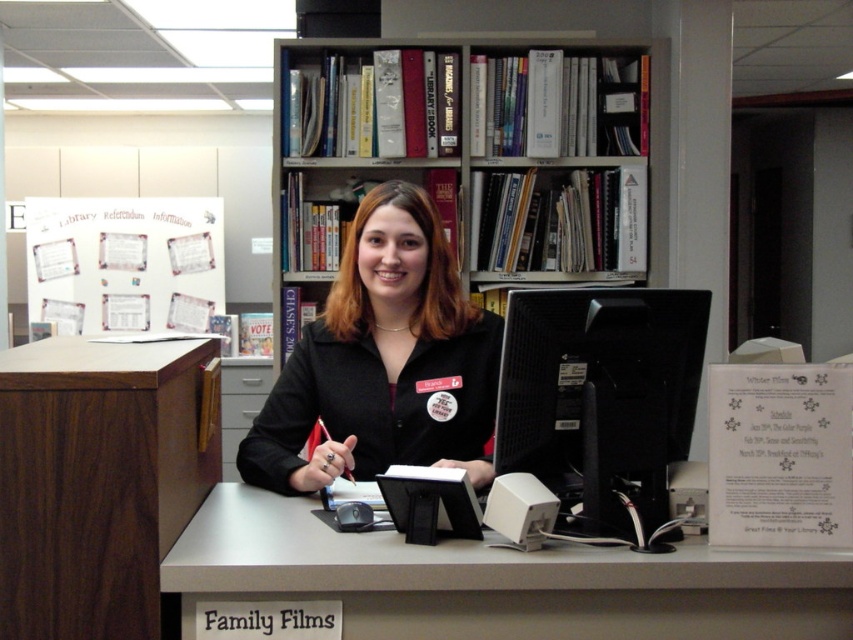
You are an office worker who needs to place a new poster on the wall. The poster is 1.2 meters tall. Which object between the wooden bookshelf at upper center and the walnut wood file cabinet at left would you choose to place the poster above, considering their heights?

The wooden bookshelf at upper center is taller than the walnut wood file cabinet at left, so you should place the poster above the wooden bookshelf at upper center because it can accommodate the poster height of 1.2 meters.

You are standing in front of the desk and want to reach both points on the desk. Which point, point (x=405, y=456) or point (x=102, y=241), is closer to you?

Point (x=405, y=456) is closer to you than point (x=102, y=241).